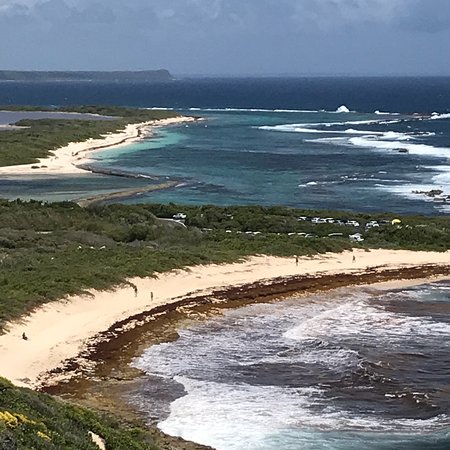
Locate an element on the screen. foam is located at coordinates (227, 424), (327, 318), (195, 338), (423, 148), (299, 124), (442, 177), (209, 108).